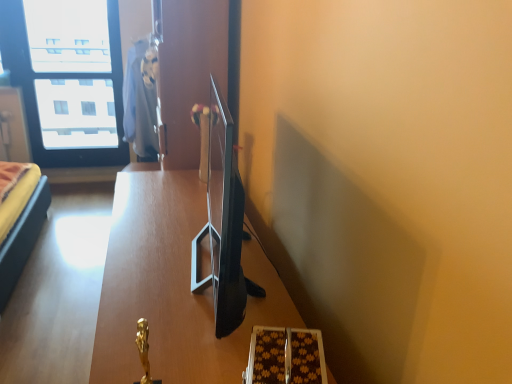
I want to click on vacant area on top of wooden table at center (from a real-world perspective), so click(x=174, y=248).